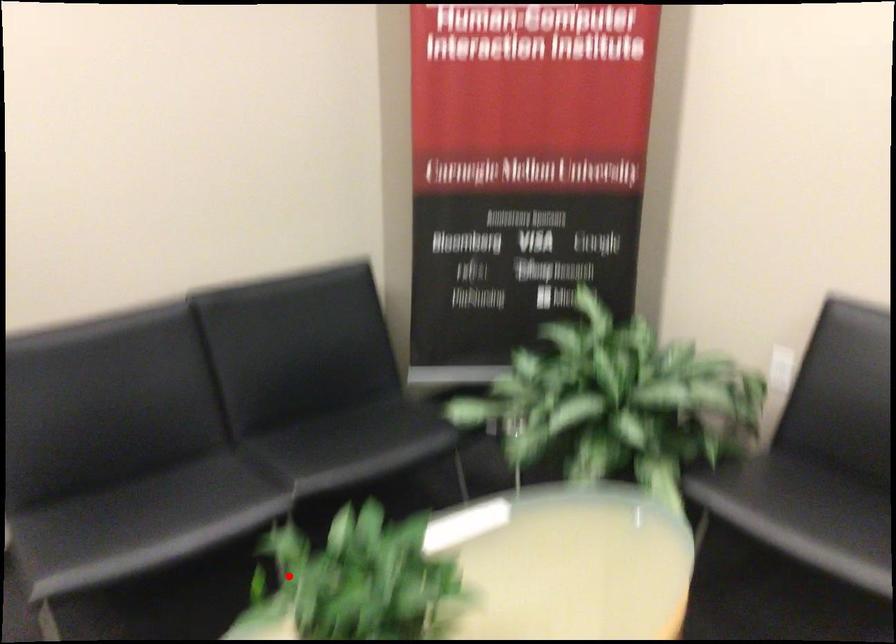
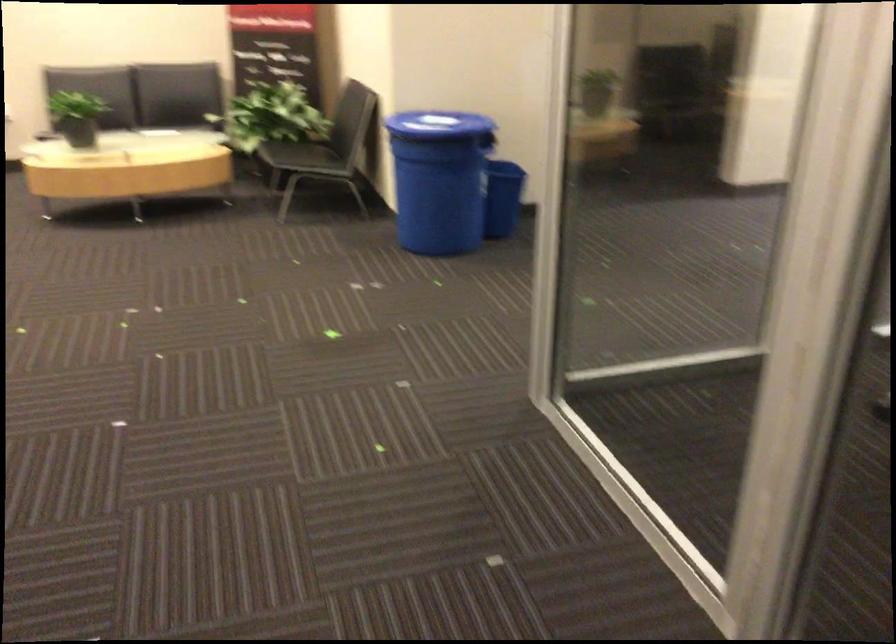
Find the pixel in the second image that matches the highlighted location in the first image.

(76, 116)